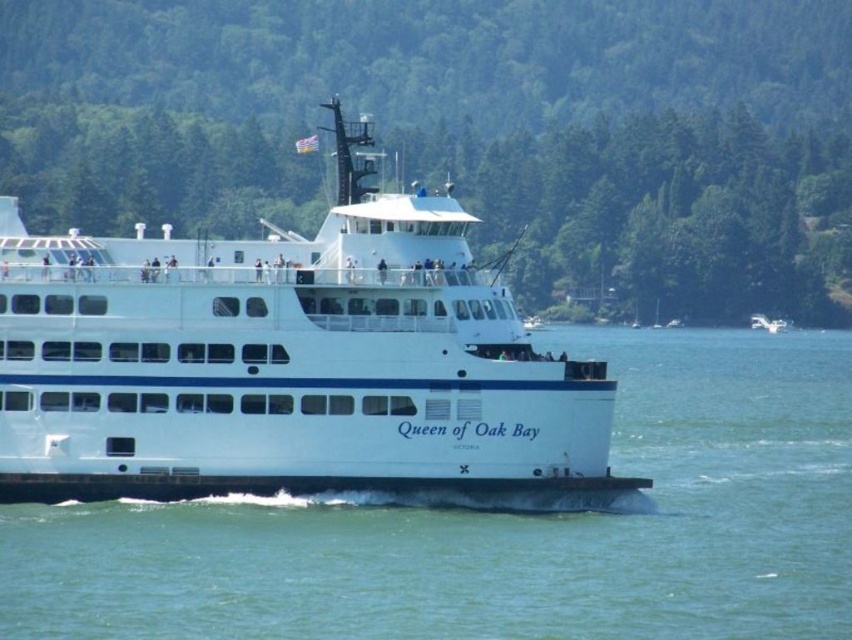
You are a photographer trying to capture the white glossy cruise ship at center and the clear blue water at center in a single shot. Based on their sizes, which object should you focus on first to ensure both are in frame?

The clear blue water at center has a smaller size compared to the white glossy cruise ship at center, so you should focus on the white glossy cruise ship at center first to ensure both fit in the frame.

You are standing on the upper deck of the Queen of Oak Bay ferry and looking towards the point marked by coordinates [465,132]. What do you see in that direction?

You see the green leafy trees at center in the direction of the point marked by coordinates [465,132].

You are a photographer on the dock and want to capture both the white glossy cruise ship at center and the white matte ferry at center in a single photo. Which one should you position closer to the left side of your camera frame to ensure both are visible?

You should position the white glossy cruise ship at center closer to the left side of your camera frame because it is already to the left of the white matte ferry at center.